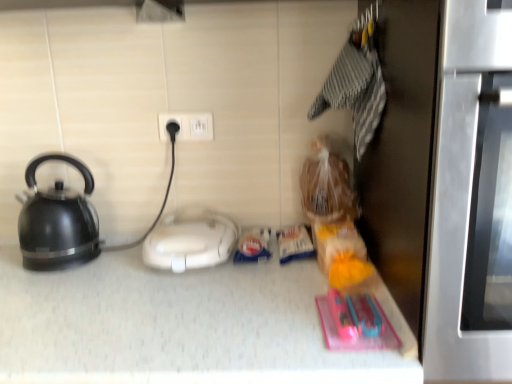
Question: Considering the relative sizes of white plastic appliance at center and stainless steel oven at right in the image provided, is white plastic appliance at center taller than stainless steel oven at right?

Choices:
 (A) yes
 (B) no

Answer: (B)

Question: Is white plastic appliance at center completely or partially outside of stainless steel oven at right?

Choices:
 (A) no
 (B) yes

Answer: (B)

Question: Does white plastic appliance at center touch stainless steel oven at right?

Choices:
 (A) yes
 (B) no

Answer: (B)

Question: From a real-world perspective, is white plastic appliance at center on top of stainless steel oven at right?

Choices:
 (A) yes
 (B) no

Answer: (B)

Question: Are white plastic appliance at center and stainless steel oven at right located far from each other?

Choices:
 (A) no
 (B) yes

Answer: (A)

Question: Considering the relative sizes of white plastic appliance at center and stainless steel oven at right in the image provided, is white plastic appliance at center bigger than stainless steel oven at right?

Choices:
 (A) yes
 (B) no

Answer: (B)

Question: Considering the relative sizes of stainless steel oven at right and white plastic appliance at center in the image provided, is stainless steel oven at right smaller than white plastic appliance at center?

Choices:
 (A) no
 (B) yes

Answer: (A)

Question: Does stainless steel oven at right appear on the right side of white plastic appliance at center?

Choices:
 (A) no
 (B) yes

Answer: (B)

Question: Would you say stainless steel oven at right contains white plastic appliance at center?

Choices:
 (A) no
 (B) yes

Answer: (A)

Question: Can you confirm if stainless steel oven at right is bigger than white plastic appliance at center?

Choices:
 (A) no
 (B) yes

Answer: (B)

Question: From the image's perspective, is stainless steel oven at right over white plastic appliance at center?

Choices:
 (A) yes
 (B) no

Answer: (A)

Question: Can you confirm if stainless steel oven at right is shorter than white plastic appliance at center?

Choices:
 (A) yes
 (B) no

Answer: (B)

Question: From the image's perspective, does matte black kettle at left appear lower than white plastic electric outlet at center?

Choices:
 (A) yes
 (B) no

Answer: (A)